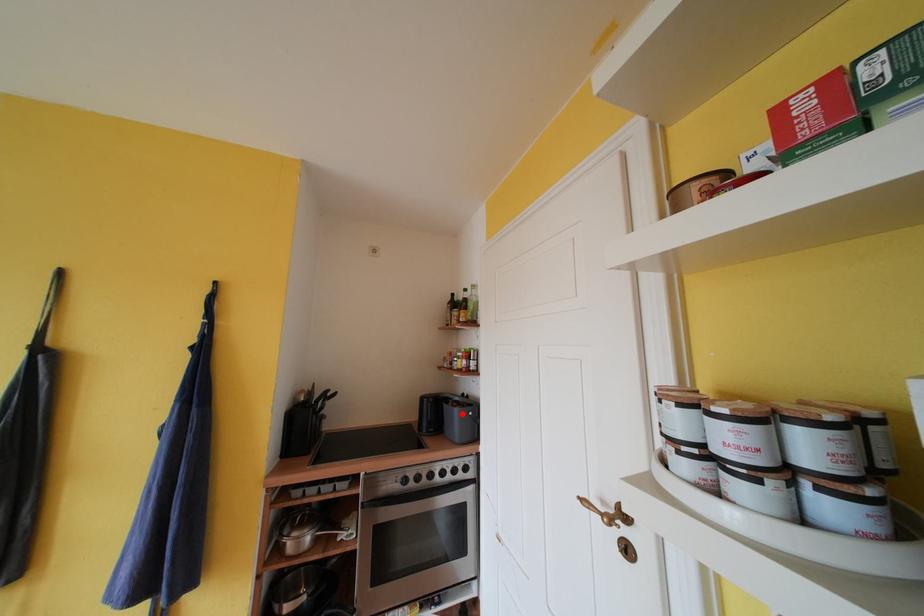
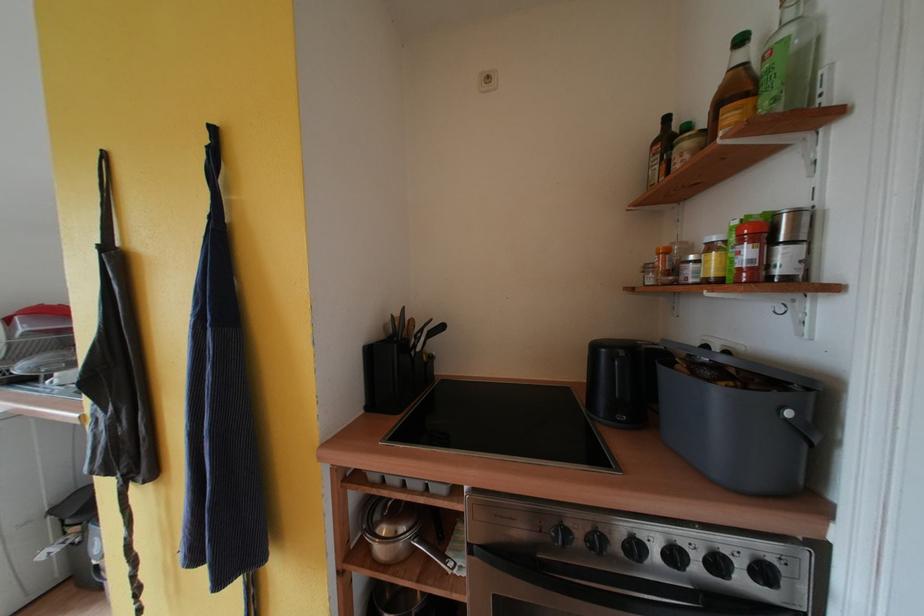
In the second image, find the point that corresponds to the highlighted location in the first image.

(723, 397)